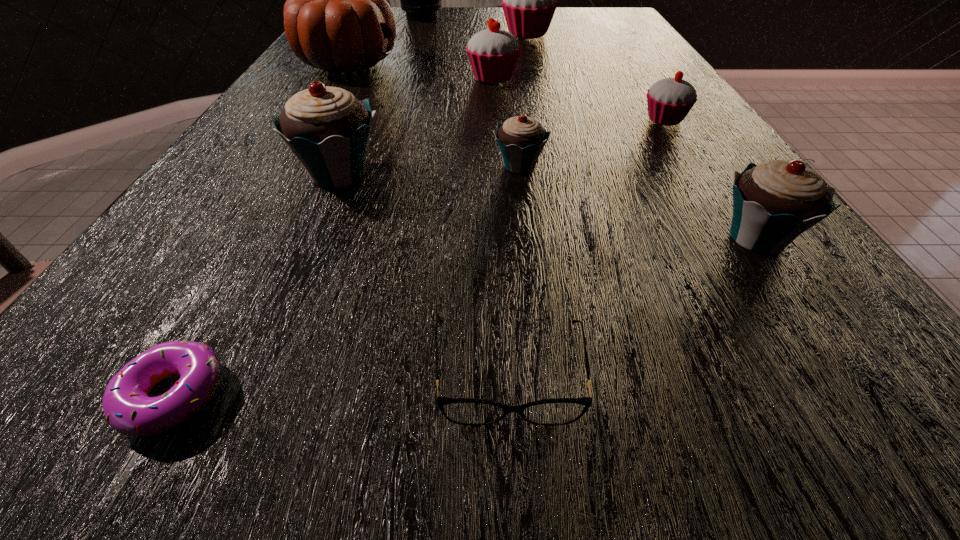
Locate an element on the screen. This screenshot has width=960, height=540. vacant point located between the farthest pink cupcake and the fourth nearest cupcake is located at coordinates (596, 77).

Where is `empty location between the second nearest pink cupcake and the orange pumpkin`? empty location between the second nearest pink cupcake and the orange pumpkin is located at coordinates (420, 71).

Find the location of a particular element. The width and height of the screenshot is (960, 540). unoccupied position between the second teal cupcake from right to left and the leftmost teal cupcake is located at coordinates (429, 170).

Locate an element on the screen. This screenshot has width=960, height=540. free space between the smallest teal cupcake and the biggest pink cupcake is located at coordinates (523, 100).

You are a GUI agent. You are given a task and a screenshot of the screen. Output one action in this format:
    pyautogui.click(x=<x>, y=<y>)
    Task: Click on the vacant area between the pink doughnut and the smallest teal cupcake
    This screenshot has width=960, height=540.
    Given the screenshot: What is the action you would take?
    pyautogui.click(x=347, y=281)

What are the coordinates of `empty space that is in between the biggest pink cupcake and the nearest cupcake` in the screenshot? It's located at [x=642, y=136].

In order to click on empty space between the rightmost pink cupcake and the second smallest pink cupcake in this screenshot , I will do `click(579, 99)`.

Find the location of a particular element. empty space between the second teal cupcake from right to left and the shortest object is located at coordinates (347, 281).

Locate which object is the seventh closest to the orange pumpkin. Please provide its 2D coordinates. Your answer should be formatted as a tuple, i.e. [(x, y)], where the tuple contains the x and y coordinates of a point satisfying the conditions above.

[(773, 203)]

Find the location of a particular element. The image size is (960, 540). object that is the second nearest to the second teal cupcake from right to left is located at coordinates (669, 100).